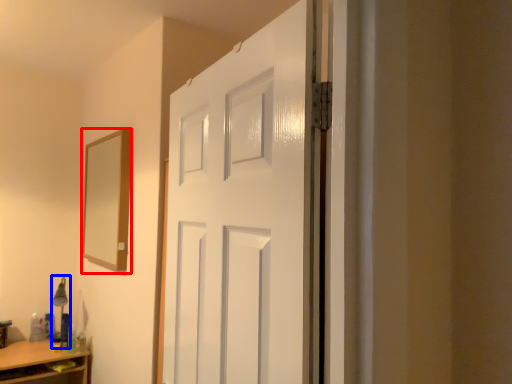
Question: Which object is further to the camera taking this photo, mirror (highlighted by a red box) or table lamp (highlighted by a blue box)?

Choices:
 (A) mirror
 (B) table lamp

Answer: (B)